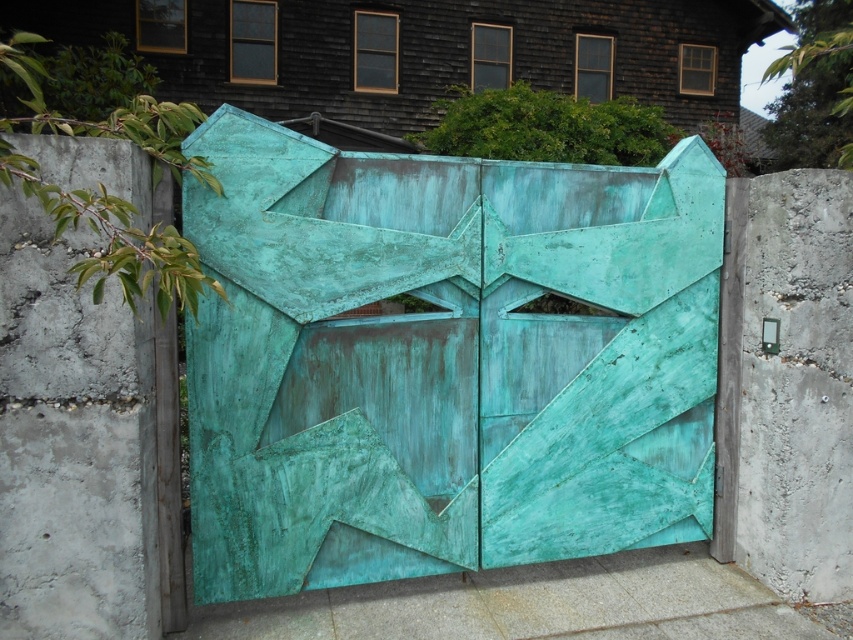
Is green patina gate at center positioned behind green patina concrete at left?

Yes, green patina gate at center is further from the viewer.

Is green patina gate at center wider than green patina concrete at left?

Correct, the width of green patina gate at center exceeds that of green patina concrete at left.

The image size is (853, 640). In order to click on green patina gate at center in this screenshot , I will do tap(444, 360).

Does green patina gate at center lie in front of smooth concrete slab at bottom center?

Yes, green patina gate at center is in front of smooth concrete slab at bottom center.

At what (x,y) coordinates should I click in order to perform the action: click on green patina gate at center. Please return your answer as a coordinate pair (x, y). Image resolution: width=853 pixels, height=640 pixels. Looking at the image, I should click on (444, 360).

Which is more to the left, green patina concrete at left or smooth concrete slab at bottom center?

Positioned to the left is green patina concrete at left.

Between green patina concrete at left and smooth concrete slab at bottom center, which one has less height?

With less height is smooth concrete slab at bottom center.

Where is `green patina concrete at left`? The width and height of the screenshot is (853, 640). green patina concrete at left is located at coordinates (73, 442).